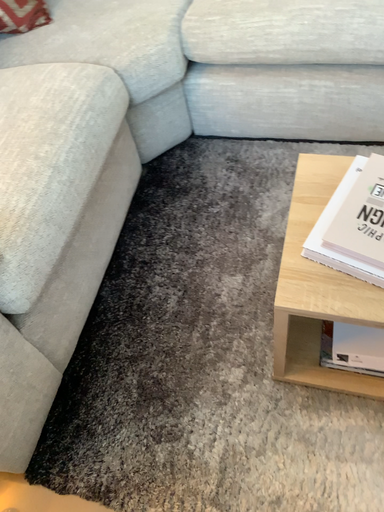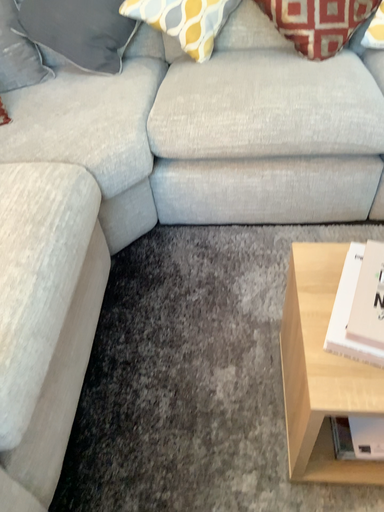
Question: How did the camera likely rotate when shooting the video?

Choices:
 (A) rotated upward
 (B) rotated downward

Answer: (A)